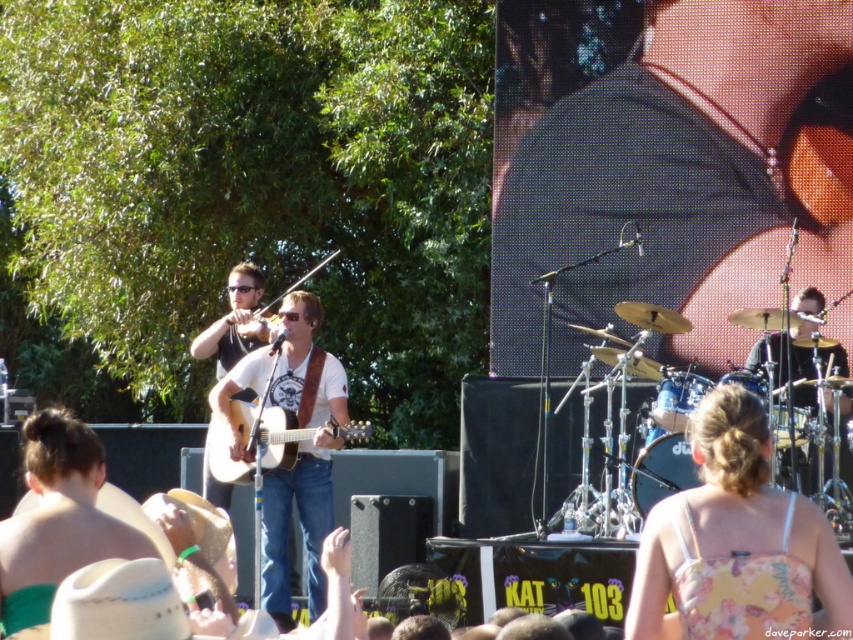
Question: Which object appears farthest from the camera in this image?

Choices:
 (A) floral fabric dress at lower right
 (B) light wood acoustic guitar at center

Answer: (B)

Question: Does white matte guitar at center come in front of light wood acoustic guitar at center?

Choices:
 (A) yes
 (B) no

Answer: (B)

Question: Is light wood acoustic guitar at center positioned behind matte black guitar at center?

Choices:
 (A) yes
 (B) no

Answer: (B)

Question: Based on their relative distances, which object is nearer to the floral fabric dress at lower right?

Choices:
 (A) black drum set at right
 (B) matte white guitar at center
 (C) light wood acoustic guitar at center

Answer: (B)

Question: Can you confirm if matte white guitar at center is positioned to the right of black drum set at right?

Choices:
 (A) yes
 (B) no

Answer: (B)

Question: Which of the following is the farthest from the observer?

Choices:
 (A) (299, 333)
 (B) (634, 628)

Answer: (A)